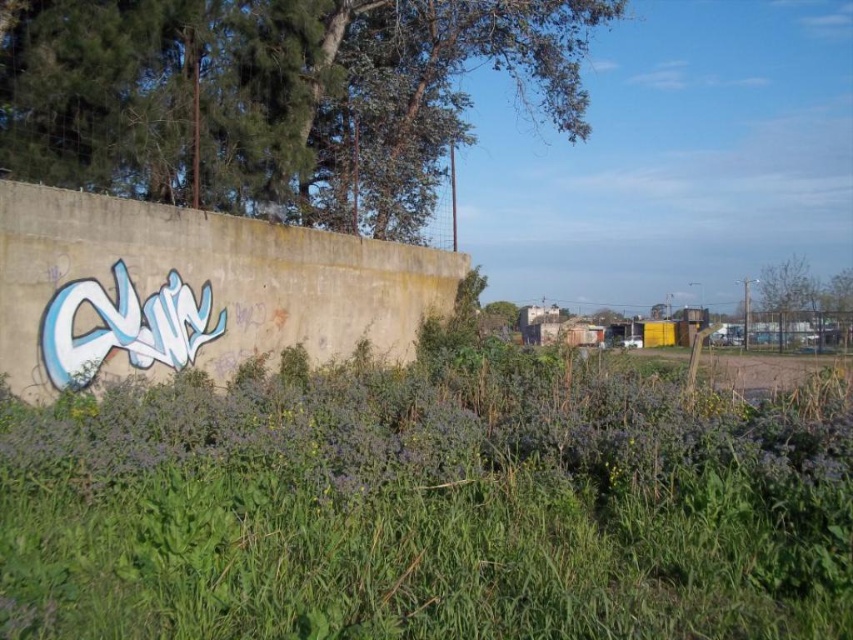
Does point (401, 529) come in front of point (404, 122)?

Yes, it is in front of point (404, 122).

Which is in front, point (170, 458) or point (608, 4)?

Point (170, 458) is in front.

Who is more distant from viewer, (x=117, y=474) or (x=231, y=116)?

Point (x=231, y=116)

Find the location of a particular element. This screenshot has height=640, width=853. green leafy grass at center is located at coordinates (428, 508).

Does green leafy grass at center have a smaller size compared to green leafy tree at upper right?

No, green leafy grass at center is not smaller than green leafy tree at upper right.

Is green leafy grass at center wider than green leafy tree at upper right?

Correct, the width of green leafy grass at center exceeds that of green leafy tree at upper right.

Between point (618, 588) and point (786, 340), which one is positioned in front?

Positioned in front is point (618, 588).

This screenshot has height=640, width=853. I want to click on green leafy grass at center, so click(x=428, y=508).

Does green leafy tree at upper left lie in front of green leafy tree at upper right?

Yes, it is.

Which of these two, green leafy tree at upper left or green leafy tree at upper right, stands taller?

With more height is green leafy tree at upper left.

Does point (540, 44) come closer to viewer compared to point (804, 282)?

Yes.

Find the location of `green leafy tree at upper left`. green leafy tree at upper left is located at coordinates (274, 97).